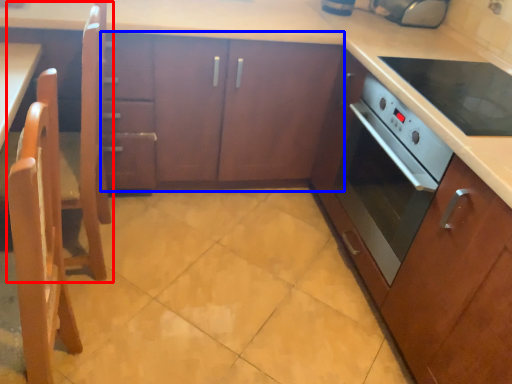
Question: Which point is closer to the camera, chair (highlighted by a red box) or cabinetry (highlighted by a blue box)?

Choices:
 (A) chair
 (B) cabinetry

Answer: (A)